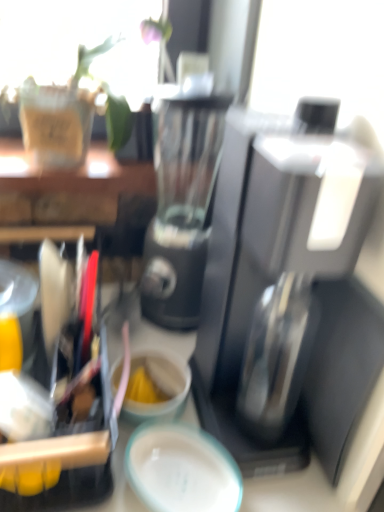
Question: Are teal glossy plate at center and sleek black coffee maker at center located far from each other?

Choices:
 (A) no
 (B) yes

Answer: (A)

Question: Is teal glossy plate at center completely or partially outside of sleek black coffee maker at center?

Choices:
 (A) yes
 (B) no

Answer: (A)

Question: Can you confirm if teal glossy plate at center is wider than sleek black coffee maker at center?

Choices:
 (A) no
 (B) yes

Answer: (A)

Question: Considering the relative positions of teal glossy plate at center and sleek black coffee maker at center in the image provided, is teal glossy plate at center to the left of sleek black coffee maker at center from the viewer's perspective?

Choices:
 (A) no
 (B) yes

Answer: (B)

Question: Does teal glossy plate at center come in front of sleek black coffee maker at center?

Choices:
 (A) yes
 (B) no

Answer: (B)

Question: Looking at their shapes, would you say sleek black coffee maker at center is wider or thinner than teal glossy plate at center?

Choices:
 (A) thin
 (B) wide

Answer: (B)

Question: Considering the positions of sleek black coffee maker at center and teal glossy plate at center in the image, is sleek black coffee maker at center bigger or smaller than teal glossy plate at center?

Choices:
 (A) big
 (B) small

Answer: (A)

Question: Is sleek black coffee maker at center to the left or to the right of teal glossy plate at center in the image?

Choices:
 (A) left
 (B) right

Answer: (B)

Question: In terms of height, does sleek black coffee maker at center look taller or shorter compared to teal glossy plate at center?

Choices:
 (A) short
 (B) tall

Answer: (B)

Question: Relative to matte ceramic coffee cup at center, is teal glossy plate at center in front or behind?

Choices:
 (A) behind
 (B) front

Answer: (B)

Question: From the image's perspective, relative to matte ceramic coffee cup at center, is teal glossy plate at center above or below?

Choices:
 (A) below
 (B) above

Answer: (A)

Question: In the image, is teal glossy plate at center on the left side or the right side of matte ceramic coffee cup at center?

Choices:
 (A) right
 (B) left

Answer: (A)

Question: In terms of width, does teal glossy plate at center look wider or thinner when compared to matte ceramic coffee cup at center?

Choices:
 (A) wide
 (B) thin

Answer: (A)

Question: Does point (175, 378) appear closer or farther from the camera than point (233, 333)?

Choices:
 (A) farther
 (B) closer

Answer: (A)

Question: In the image, is matte ceramic coffee cup at center positioned in front of or behind sleek black coffee maker at center?

Choices:
 (A) behind
 (B) front

Answer: (A)